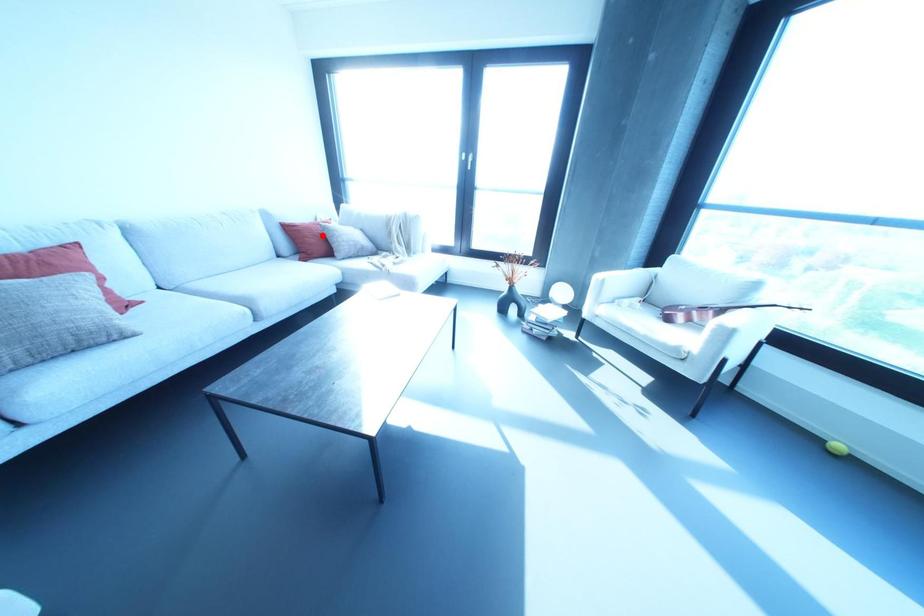
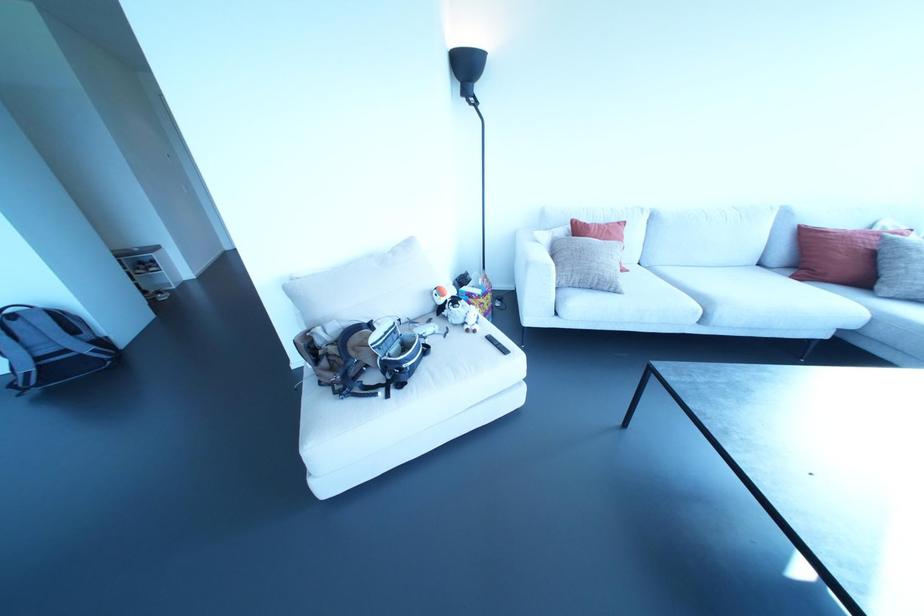
In the second image, find the point that corresponds to the highlighted location in the first image.

(872, 254)